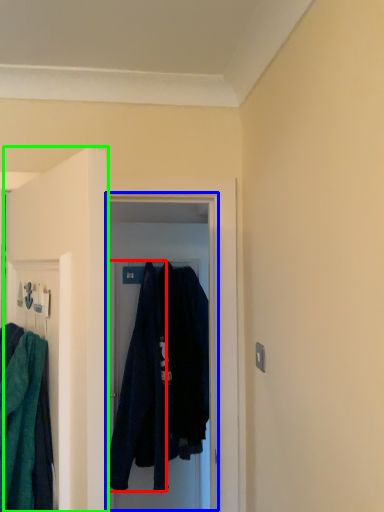
Question: Considering the real-world distances, which object is closest to robe (highlighted by a red box)? glass door (highlighted by a blue box) or door (highlighted by a green box).

Choices:
 (A) glass door
 (B) door

Answer: (A)